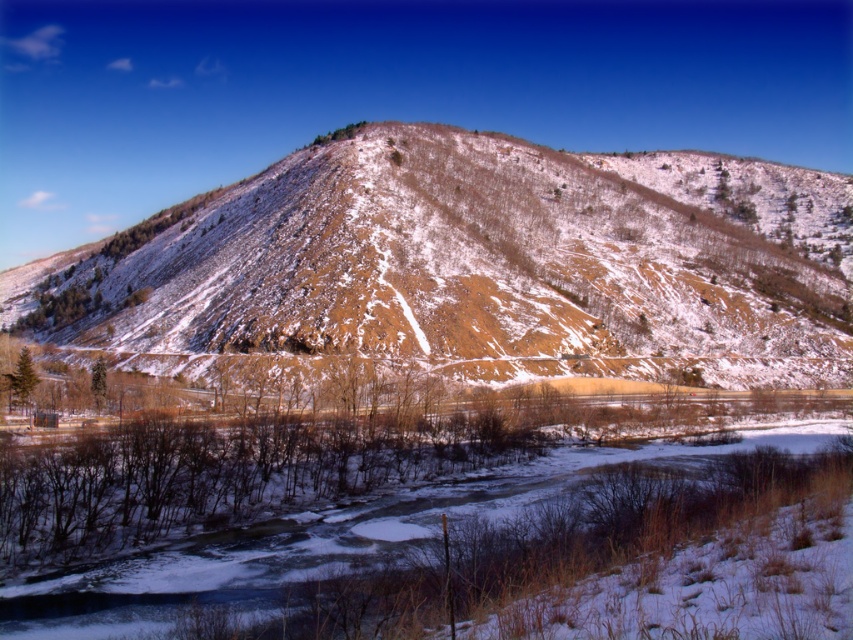
Based on the photo, you are standing at the origin point in the coordinate system of the image. The brown textured mountain at center is at coordinates approximately 0.414 in the x and 0.558 in the y. If you want to move towards the mountain, which direction should you move in terms of x and y coordinates?

To move towards the brown textured mountain at center located at coordinates approximately 0.414 in the x and 0.558 in the y, you should move in the positive x and positive y direction since the mountain is at a higher x and y coordinate than the origin point.

You are an outdoor photographer planning to capture the white snowy river at lower center and the brown textured mountain at center in a single frame. Based on the scene, can you determine which object will appear closer to the camera in your photograph?

The brown textured mountain at center will appear closer to the camera because the white snowy river at lower center is positioned behind it.